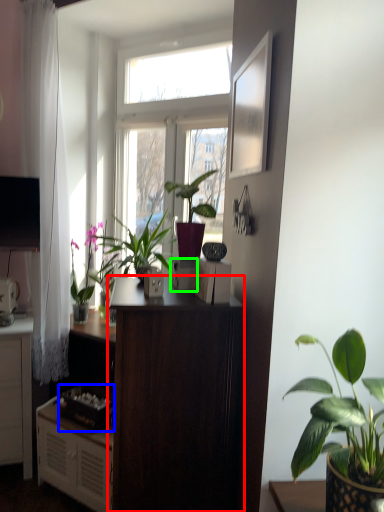
Question: Estimate the real-world distances between objects in this image. Which object is closer to desk (highlighted by a red box), appliance (highlighted by a blue box) or appliance (highlighted by a green box)?

Choices:
 (A) appliance
 (B) appliance

Answer: (B)